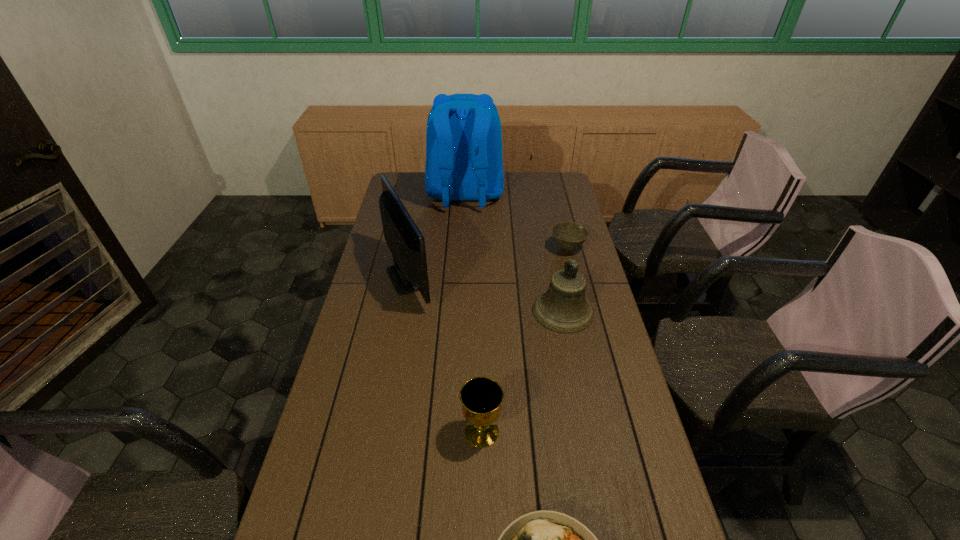
I want to click on the farthest object, so click(x=464, y=162).

You are a GUI agent. You are given a task and a screenshot of the screen. Output one action in this format:
    pyautogui.click(x=<x>, y=<y>)
    Task: Click on the tallest object
    The image size is (960, 540).
    Given the screenshot: What is the action you would take?
    pyautogui.click(x=464, y=162)

You are a GUI agent. You are given a task and a screenshot of the screen. Output one action in this format:
    pyautogui.click(x=<x>, y=<y>)
    Task: Click on the fifth shortest object
    Image resolution: width=960 pixels, height=540 pixels.
    Given the screenshot: What is the action you would take?
    pyautogui.click(x=409, y=273)

You are a GUI agent. You are given a task and a screenshot of the screen. Output one action in this format:
    pyautogui.click(x=<x>, y=<y>)
    Task: Click on the bell
    The image size is (960, 540).
    Given the screenshot: What is the action you would take?
    pyautogui.click(x=563, y=308)

Where is `chalice`? The width and height of the screenshot is (960, 540). chalice is located at coordinates (481, 397).

At what (x,y) coordinates should I click in order to perform the action: click on the second nearest object. Please return your answer as a coordinate pair (x, y). The width and height of the screenshot is (960, 540). Looking at the image, I should click on (481, 397).

Where is `bowl`? bowl is located at coordinates (568, 235).

The height and width of the screenshot is (540, 960). I want to click on free space located on the back of the farthest object, so click(x=462, y=272).

Locate an element on the screen. Image resolution: width=960 pixels, height=540 pixels. free space located on the front-facing side of the computer monitor is located at coordinates click(488, 277).

Locate an element on the screen. The image size is (960, 540). vacant space located on the front of the fourth shortest object is located at coordinates (585, 421).